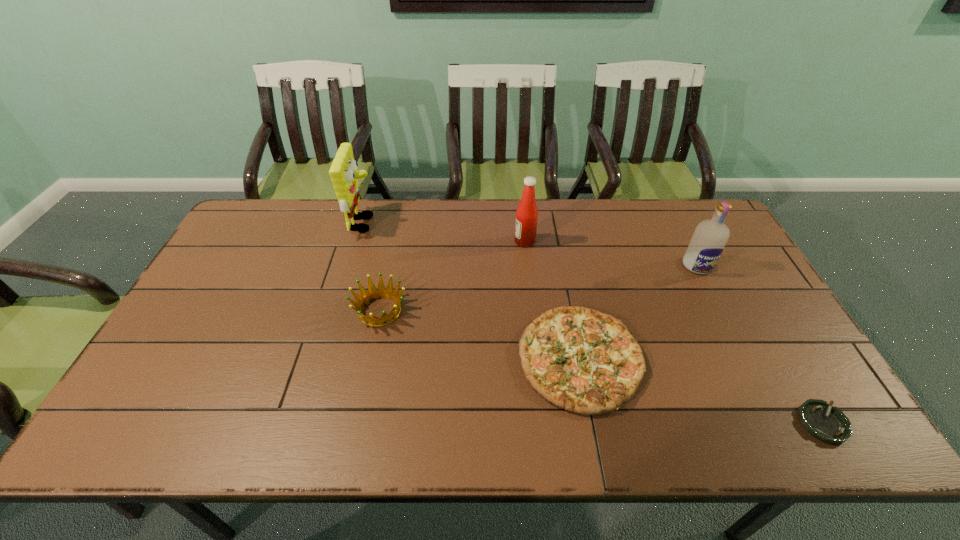
Where is `sponge`? This screenshot has width=960, height=540. sponge is located at coordinates (343, 172).

The height and width of the screenshot is (540, 960). Find the location of `condiment`. condiment is located at coordinates (527, 213).

Locate an element on the screen. the second object from right to left is located at coordinates (707, 244).

This screenshot has height=540, width=960. Find the location of `vodka`. vodka is located at coordinates (707, 244).

The height and width of the screenshot is (540, 960). Find the location of `crown`. crown is located at coordinates (373, 293).

Find the location of `pizza`. pizza is located at coordinates pyautogui.click(x=587, y=362).

Image resolution: width=960 pixels, height=540 pixels. What are the coordinates of `the shortest object` in the screenshot? It's located at (829, 424).

The height and width of the screenshot is (540, 960). Find the location of `ashtray`. ashtray is located at coordinates [x=829, y=424].

You are a GUI agent. You are given a task and a screenshot of the screen. Output one action in this format:
    pyautogui.click(x=<x>, y=<y>)
    Task: Click on the free space located 0.210m on the face of the sponge
    Image resolution: width=960 pixels, height=540 pixels.
    Given the screenshot: What is the action you would take?
    coord(438,224)

You are a GUI agent. You are given a task and a screenshot of the screen. Output one action in this format:
    pyautogui.click(x=<x>, y=<y>)
    Task: Click on the vacant space located 0.140m on the front-facing side of the condiment
    Image resolution: width=960 pixels, height=540 pixels.
    Given the screenshot: What is the action you would take?
    pyautogui.click(x=472, y=241)